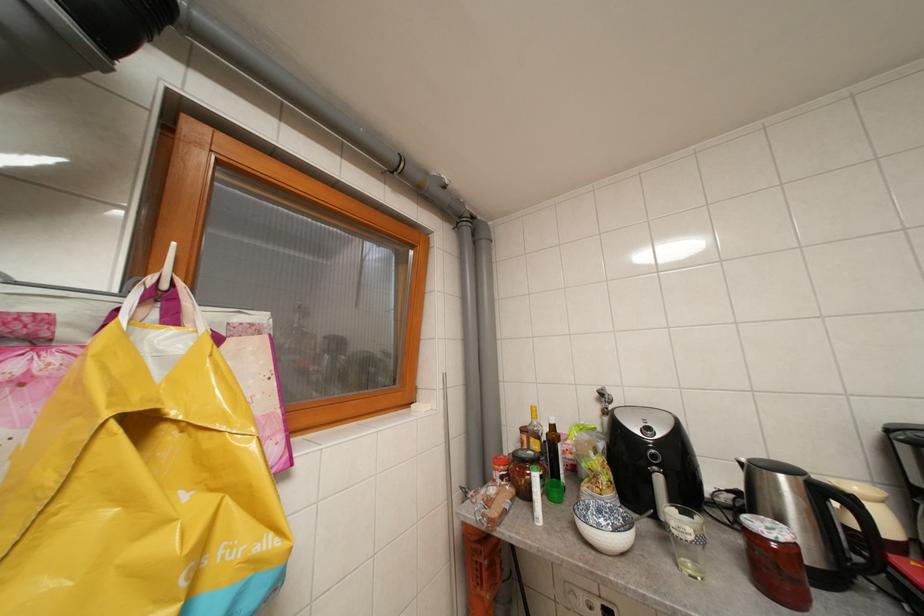
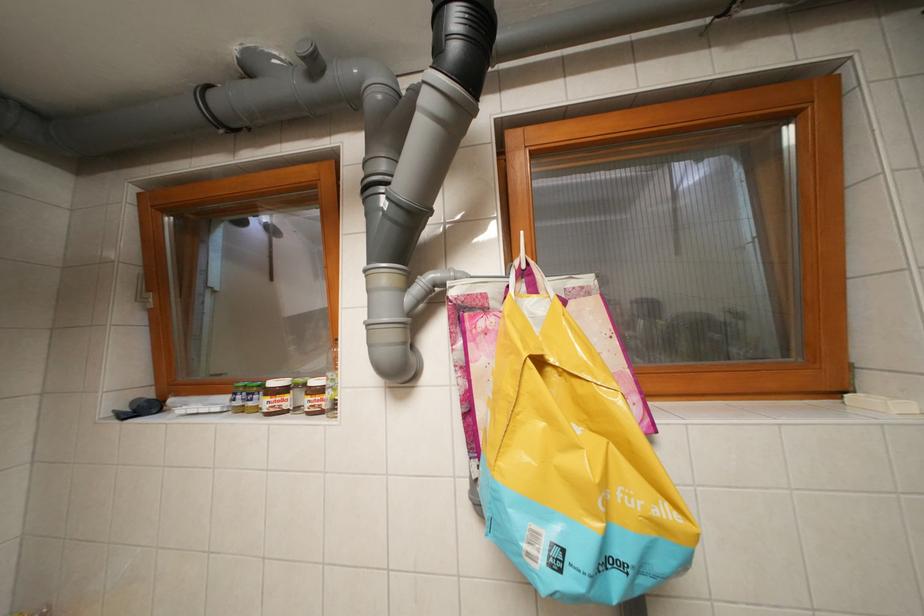
Question: How did the camera likely rotate?

Choices:
 (A) Left
 (B) Right
 (C) Up
 (D) Down

Answer: (A)